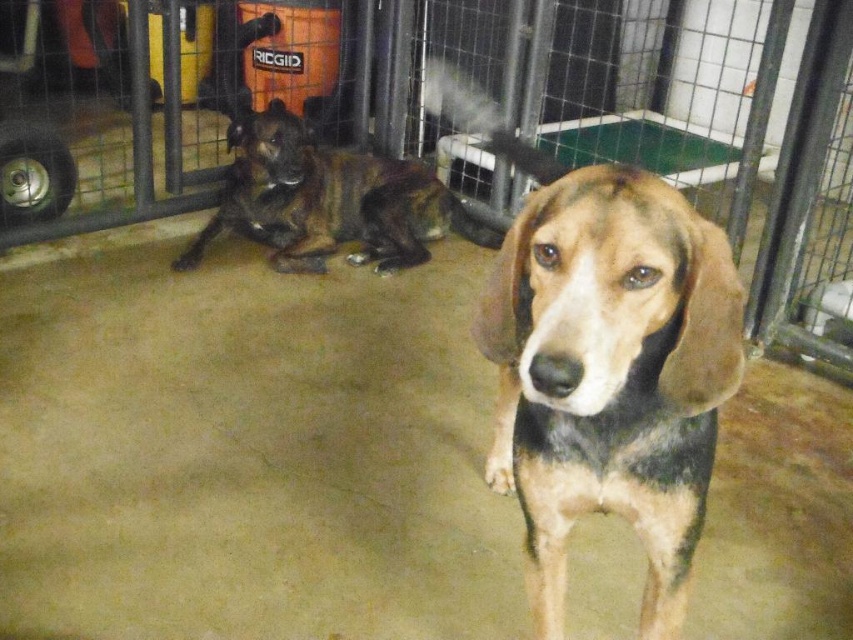
Question: Among these objects, which one is nearest to the camera?

Choices:
 (A) tri-colored fur dog at center
 (B) metal wire fence at center

Answer: (A)

Question: Which of these objects is positioned farthest from the metal wire fence at center?

Choices:
 (A) tri-colored fur dog at center
 (B) brown brindle dog at left

Answer: (A)

Question: Which point is closer to the camera taking this photo?

Choices:
 (A) (338, 220)
 (B) (561, 504)

Answer: (B)

Question: Does metal wire fence at center have a smaller size compared to brown brindle dog at left?

Choices:
 (A) yes
 (B) no

Answer: (B)

Question: Is metal wire fence at center closer to camera compared to tri-colored fur dog at center?

Choices:
 (A) yes
 (B) no

Answer: (B)

Question: Does metal wire fence at center appear on the left side of tri-colored fur dog at center?

Choices:
 (A) no
 (B) yes

Answer: (B)